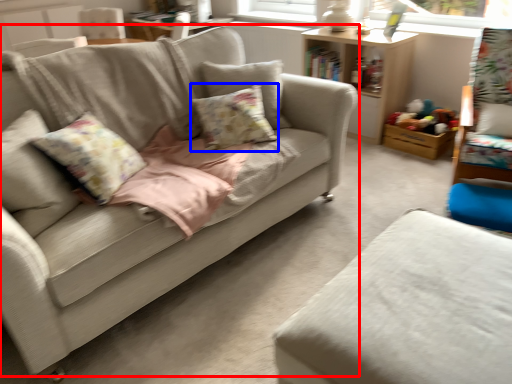
Question: Among these objects, which one is nearest to the camera, studio couch (highlighted by a red box) or pillow (highlighted by a blue box)?

Choices:
 (A) studio couch
 (B) pillow

Answer: (A)